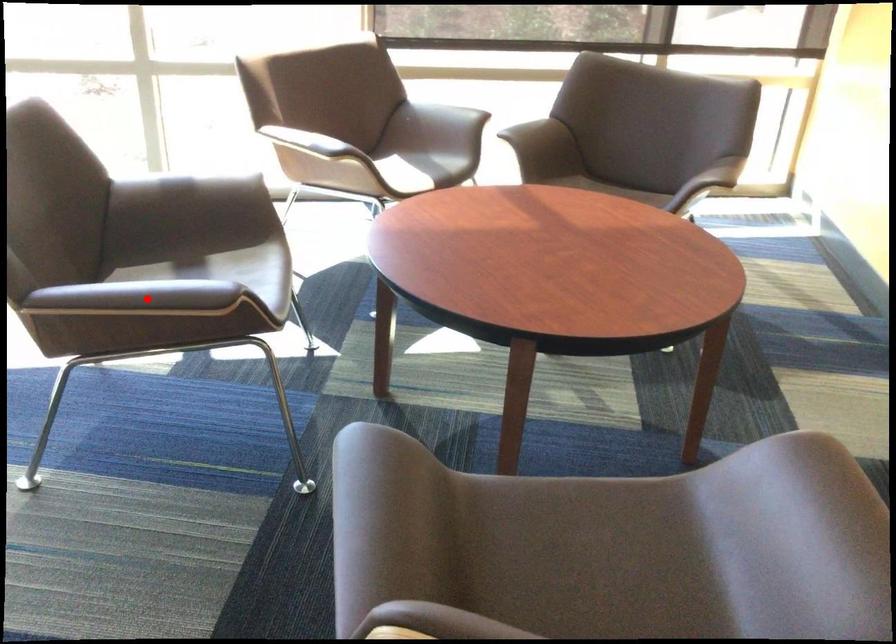
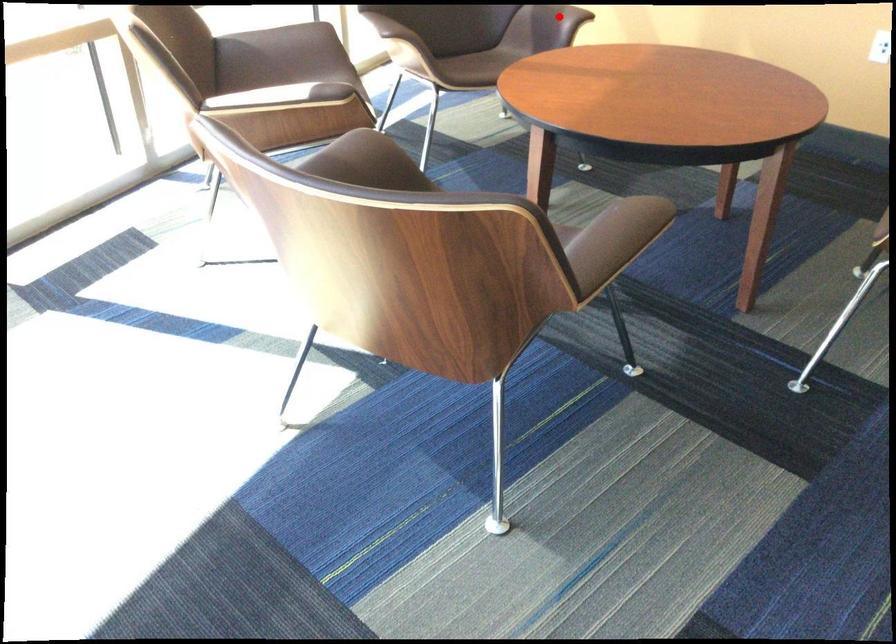
I am providing you with two images of the same scene from different viewpoints. A red point is marked on the first image and another point is marked on the second image. Is the red point in image1 aligned with the point shown in image2?

No